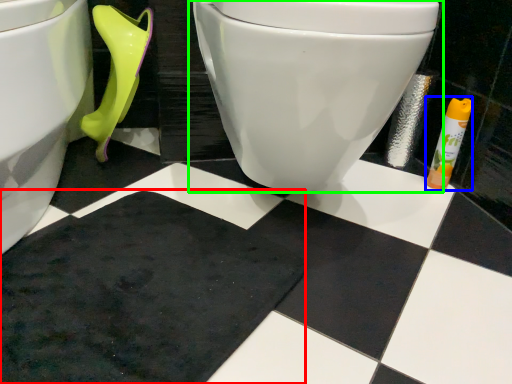
Question: Which object is the closest to the bath mat (highlighted by a red box)? Choose among these: toiletry (highlighted by a blue box) or toilet (highlighted by a green box).

Choices:
 (A) toiletry
 (B) toilet

Answer: (B)